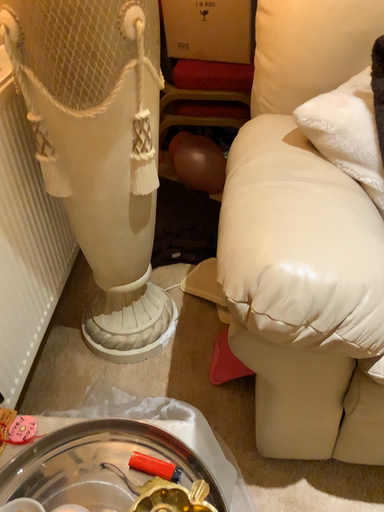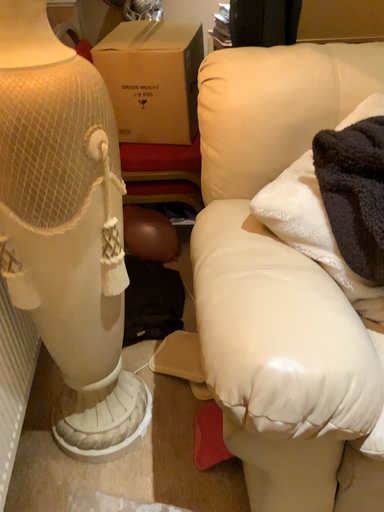
Question: Which way did the camera rotate in the video?

Choices:
 (A) rotated downward
 (B) rotated upward

Answer: (B)